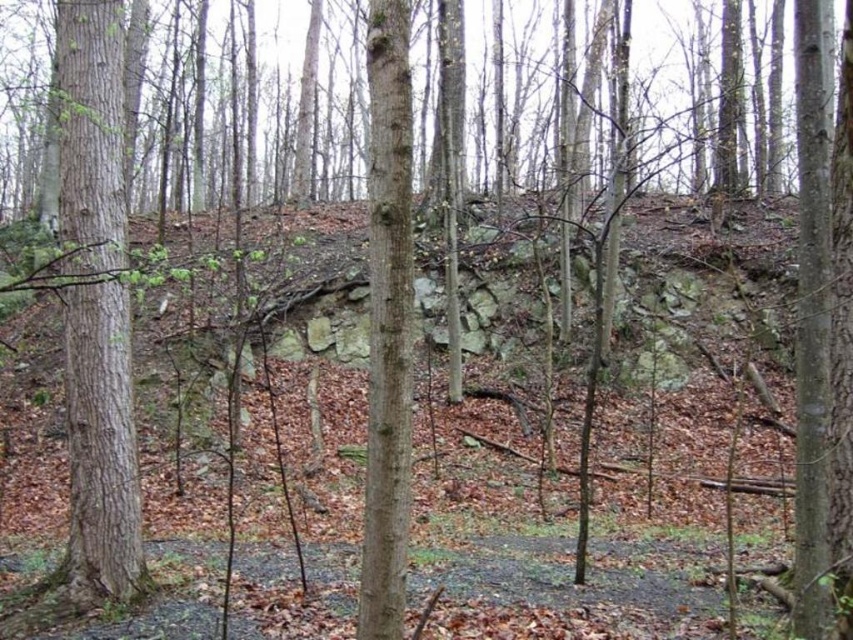
You are a hiker trying to identify landmarks in the wooded area. You see two smooth brown tree trunks. Which one is closer to you, the smooth brown tree trunk at left or the smooth brown tree trunk at center?

The smooth brown tree trunk at left is closer to you because the smooth brown tree trunk at center is behind it.

You are a hiker trying to identify two smooth brown tree trunks in the wooded area. Which one is taller between the smooth brown tree trunk at left and the smooth brown tree trunk at center?

The smooth brown tree trunk at left is much taller than the smooth brown tree trunk at center.